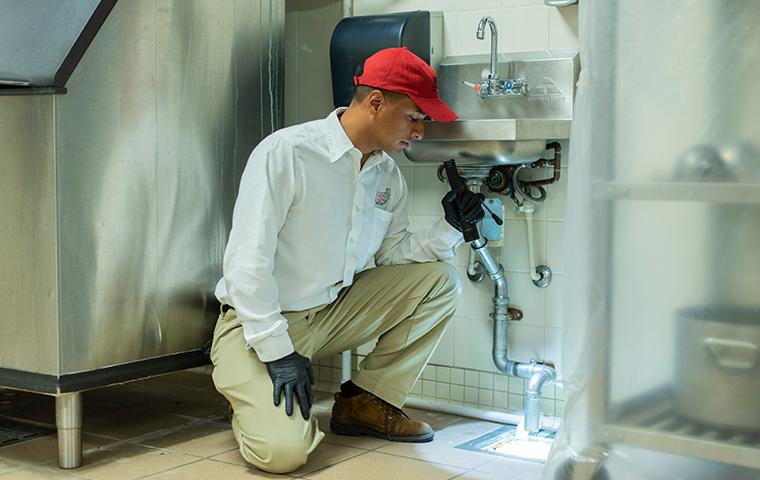
The width and height of the screenshot is (760, 480). Identify the location of cold water tap. (508, 85).